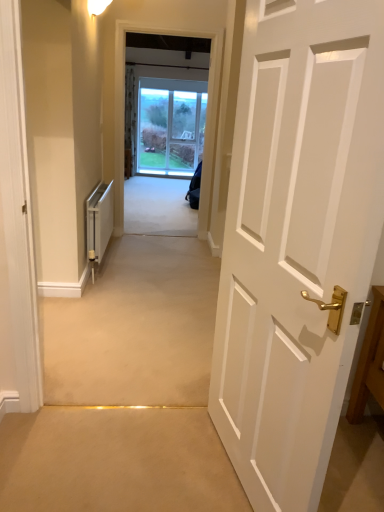
Question: Is white metallic radiator at left to the left of white painted wood door at right from the viewer's perspective?

Choices:
 (A) no
 (B) yes

Answer: (B)

Question: Is white metallic radiator at left next to white painted wood door at right and touching it?

Choices:
 (A) no
 (B) yes

Answer: (A)

Question: Is white metallic radiator at left further to camera compared to white painted wood door at right?

Choices:
 (A) no
 (B) yes

Answer: (B)

Question: Considering the relative sizes of white metallic radiator at left and white painted wood door at right in the image provided, is white metallic radiator at left bigger than white painted wood door at right?

Choices:
 (A) no
 (B) yes

Answer: (A)

Question: Is there a large distance between white metallic radiator at left and white painted wood door at right?

Choices:
 (A) yes
 (B) no

Answer: (A)

Question: From a real-world perspective, is white metallic radiator at left physically below white painted wood door at right?

Choices:
 (A) yes
 (B) no

Answer: (A)

Question: Is the surface of white painted wood door at right in direct contact with white metallic radiator at left?

Choices:
 (A) no
 (B) yes

Answer: (A)

Question: Can white metallic radiator at left be found inside white painted wood door at right?

Choices:
 (A) no
 (B) yes

Answer: (A)

Question: From a real-world perspective, is white painted wood door at right positioned over white metallic radiator at left based on gravity?

Choices:
 (A) no
 (B) yes

Answer: (B)

Question: Is white painted wood door at right turned away from white metallic radiator at left?

Choices:
 (A) yes
 (B) no

Answer: (B)

Question: Is white painted wood door at right not close to white metallic radiator at left?

Choices:
 (A) yes
 (B) no

Answer: (A)

Question: From the image's perspective, is white painted wood door at right located above white metallic radiator at left?

Choices:
 (A) no
 (B) yes

Answer: (A)

Question: Does point (99, 197) appear closer or farther from the camera than point (380, 81)?

Choices:
 (A) closer
 (B) farther

Answer: (B)